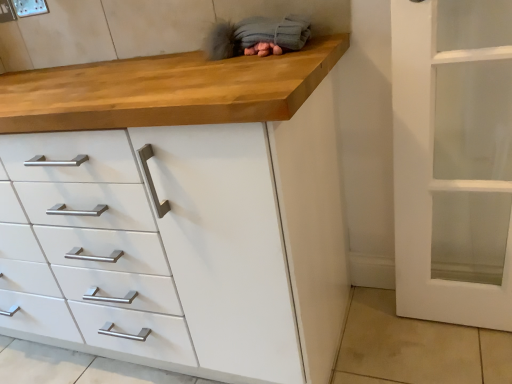
The height and width of the screenshot is (384, 512). Describe the element at coordinates (257, 36) in the screenshot. I see `fuzzy gray blanket at upper center` at that location.

I want to click on fuzzy gray blanket at upper center, so click(x=257, y=36).

Identify the location of fuzzy gray blanket at upper center. (257, 36).